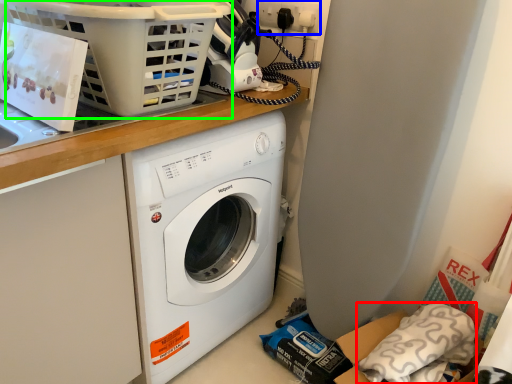
Question: Which is farther away from pillow (highlighted by a red box)? electric outlet (highlighted by a blue box) or basket (highlighted by a green box)?

Choices:
 (A) electric outlet
 (B) basket

Answer: (A)